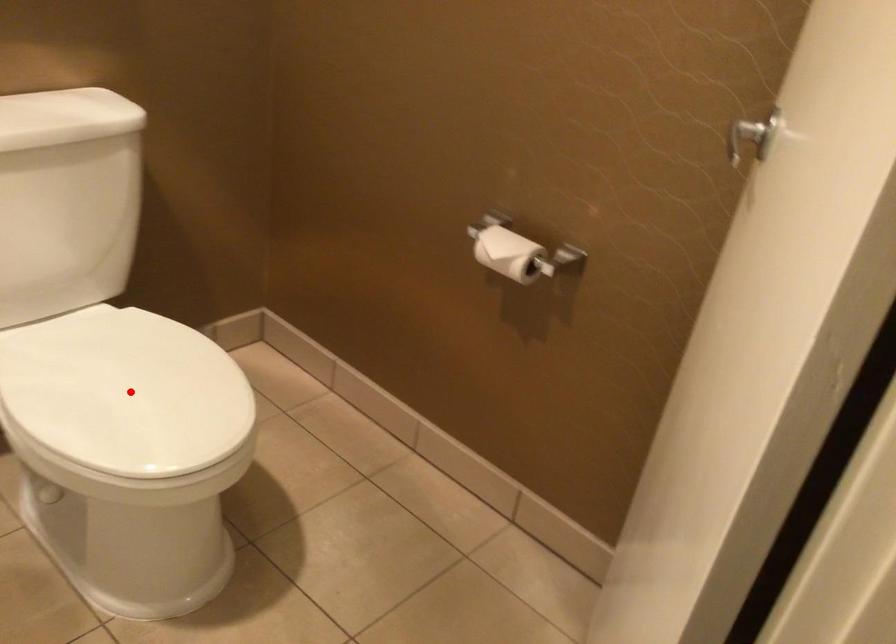
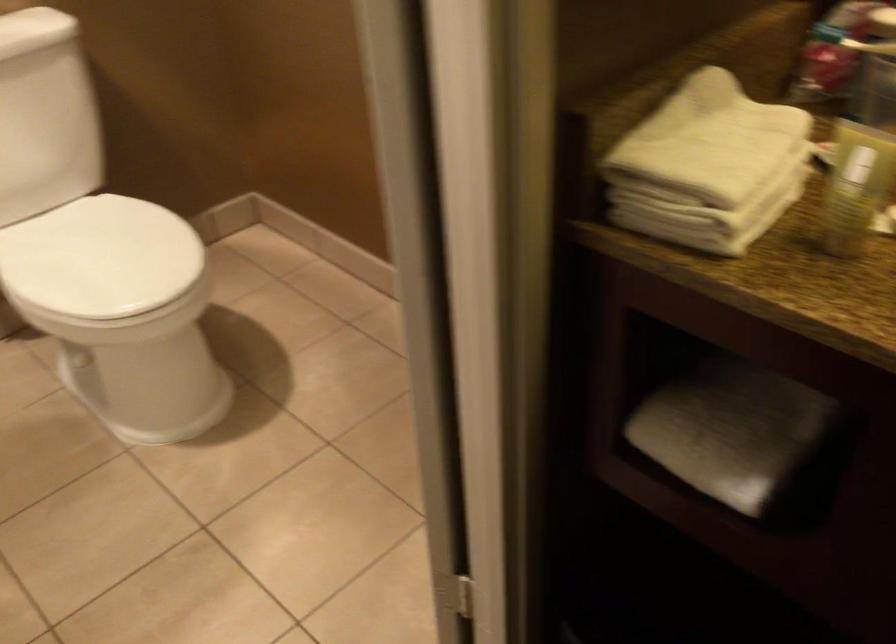
In the second image, find the point that corresponds to the highlighted location in the first image.

(99, 257)